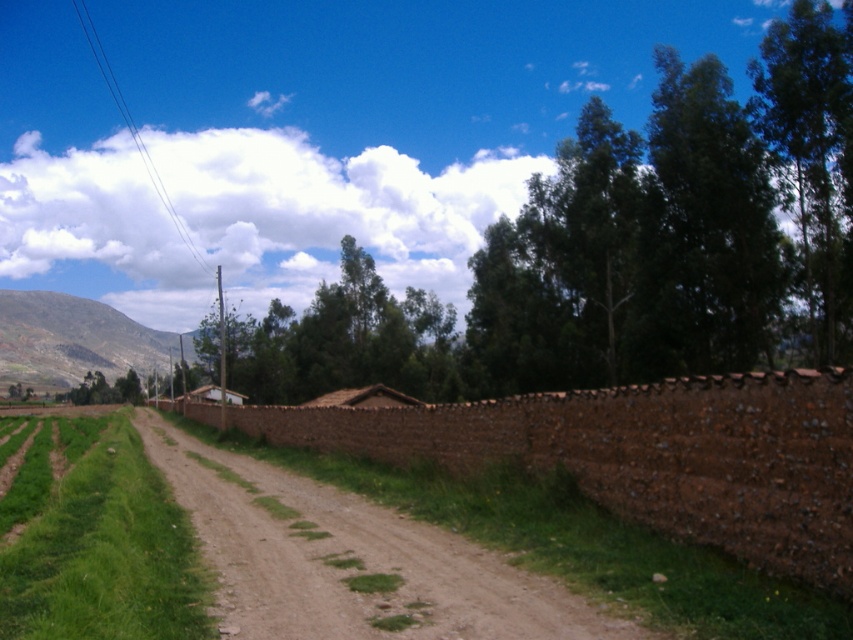
Who is positioned more to the right, green leafy tree at upper center or brown stone wall at center?

green leafy tree at upper center

What are the coordinates of `green leafy tree at upper center` in the screenshot? It's located at (621, 250).